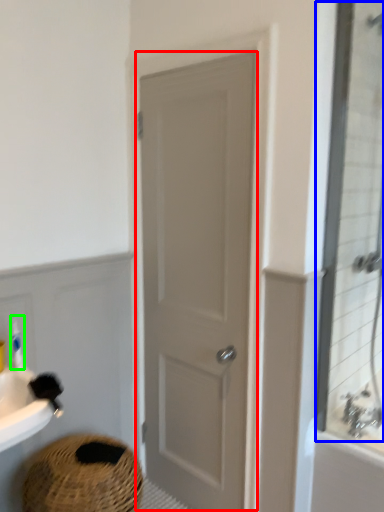
Question: Which is farther away from door (highlighted by a red box)? mirror (highlighted by a blue box) or toiletry (highlighted by a green box)?

Choices:
 (A) mirror
 (B) toiletry

Answer: (B)